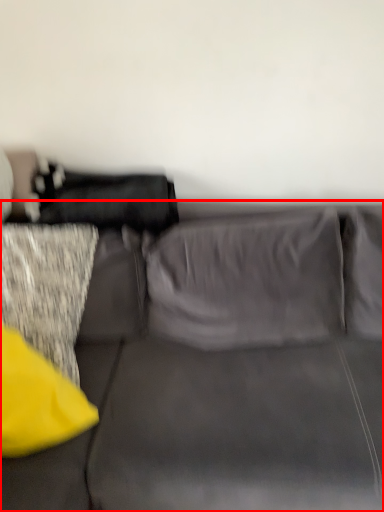
Question: From the image, what is the correct spatial relationship of studio couch (annotated by the red box) in relation to pillow?

Choices:
 (A) left
 (B) right

Answer: (B)